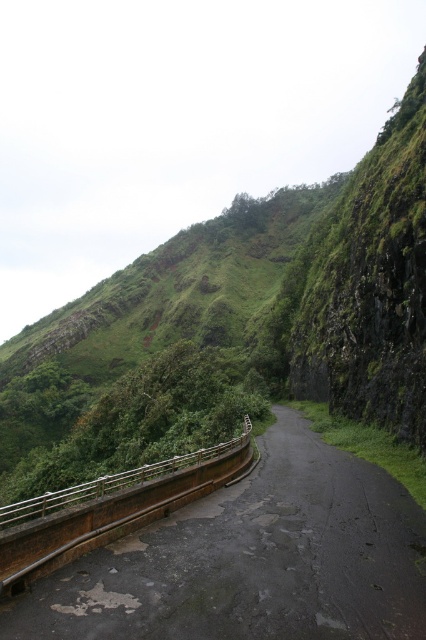
Question: Which point is closer to the camera taking this photo?

Choices:
 (A) (16, 557)
 (B) (247, 481)

Answer: (A)

Question: Which object is farther from the camera taking this photo?

Choices:
 (A) metallic gray rail at lower left
 (B) dark asphalt road at center

Answer: (A)

Question: Does dark asphalt road at center have a larger size compared to metallic gray rail at lower left?

Choices:
 (A) no
 (B) yes

Answer: (A)

Question: Is dark asphalt road at center below metallic gray rail at lower left?

Choices:
 (A) no
 (B) yes

Answer: (A)

Question: Does dark asphalt road at center appear on the left side of metallic gray rail at lower left?

Choices:
 (A) yes
 (B) no

Answer: (B)

Question: Which point is farther to the camera?

Choices:
 (A) (40, 604)
 (B) (161, 470)

Answer: (B)